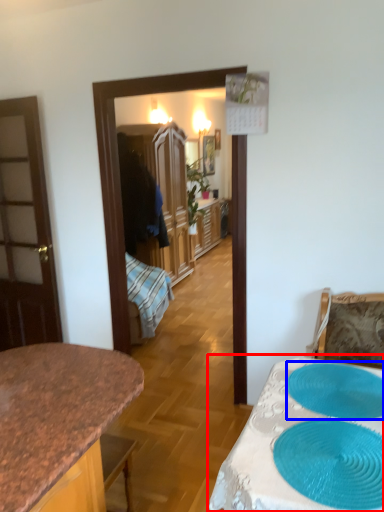
Question: Which object appears closest to the camera in this image, table (highlighted by a red box) or oval (highlighted by a blue box)?

Choices:
 (A) table
 (B) oval

Answer: (A)